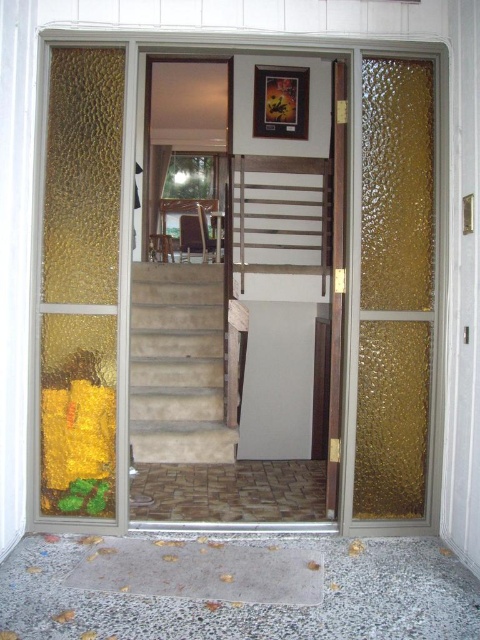
Question: Is transparent glass door at center thinner than gold textured glass door at right?

Choices:
 (A) no
 (B) yes

Answer: (A)

Question: Which object is farther from the camera taking this photo?

Choices:
 (A) beige carpeted stairs at center
 (B) transparent glass door at center
 (C) gold textured glass door at right

Answer: (B)

Question: Among these points, which one is nearest to the camera?

Choices:
 (A) (156, 449)
 (B) (377, 256)

Answer: (B)

Question: From the image, what is the correct spatial relationship of gold textured glass door at right in relation to wooden at center?

Choices:
 (A) below
 (B) above

Answer: (A)

Question: Which point is farther to the camera?

Choices:
 (A) transparent glass door at center
 (B) beige carpeted stairs at center

Answer: (A)

Question: Where is gold textured glass door at right located in relation to wooden at center in the image?

Choices:
 (A) below
 (B) above

Answer: (A)